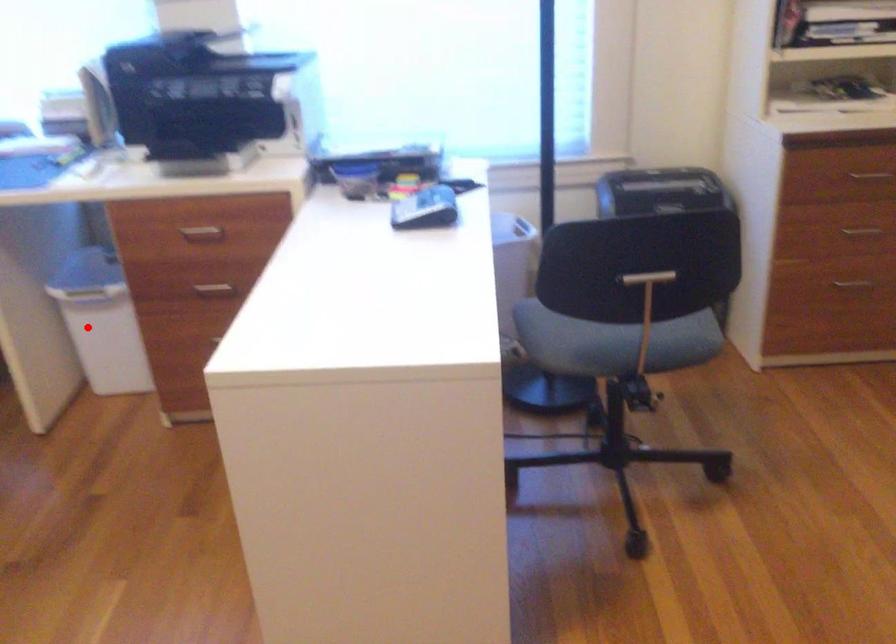
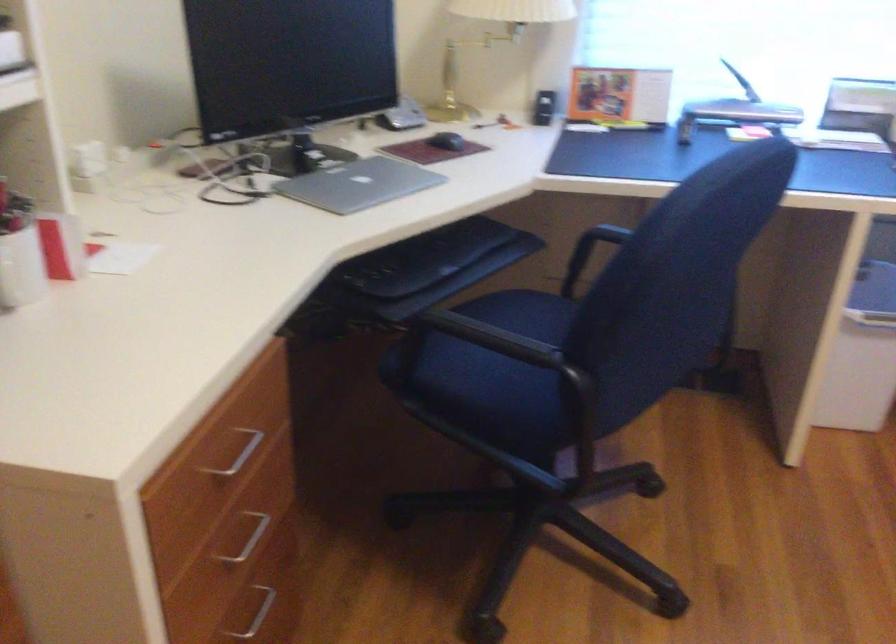
Question: A red point is marked in image1. In image2, is the corresponding 3D point closer to the camera or farther? Reply with the corresponding letter.

Choices:
 (A) The corresponding 3D point is closer.
 (B) The corresponding 3D point is farther.

Answer: (A)